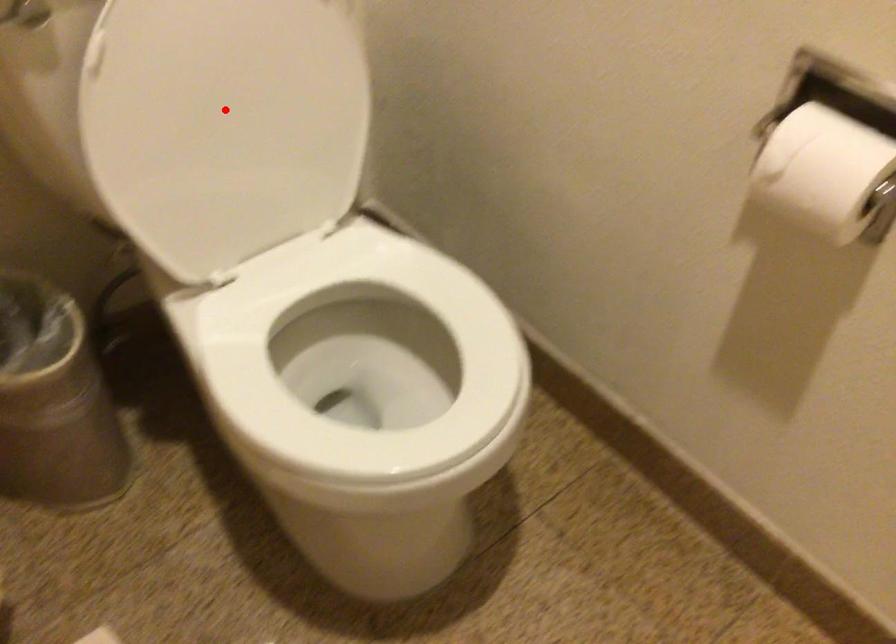
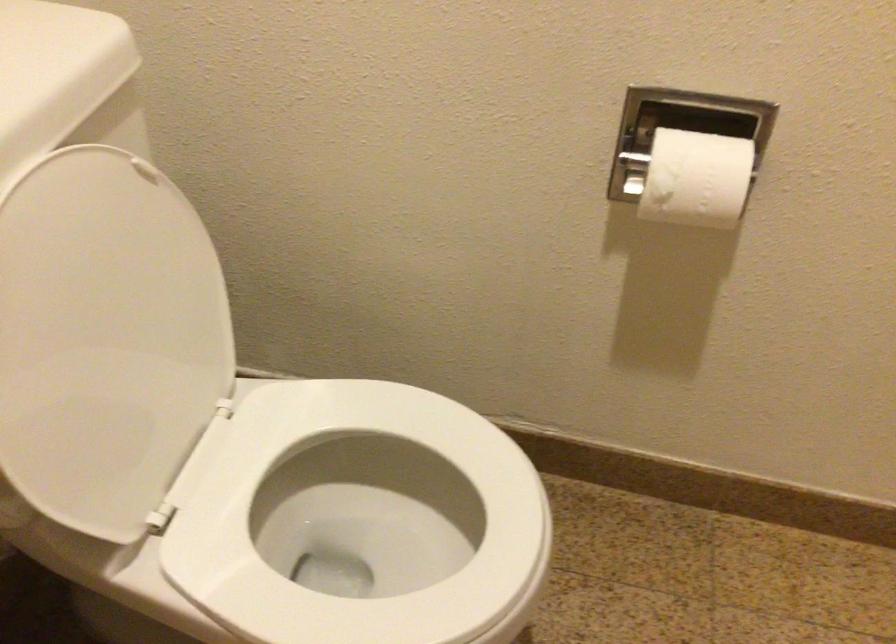
Question: I am providing you with two images of the same scene from different viewpoints. A red point is marked on the first image. Is the red point's position out of view in image 2?

Choices:
 (A) Yes
 (B) No

Answer: (B)